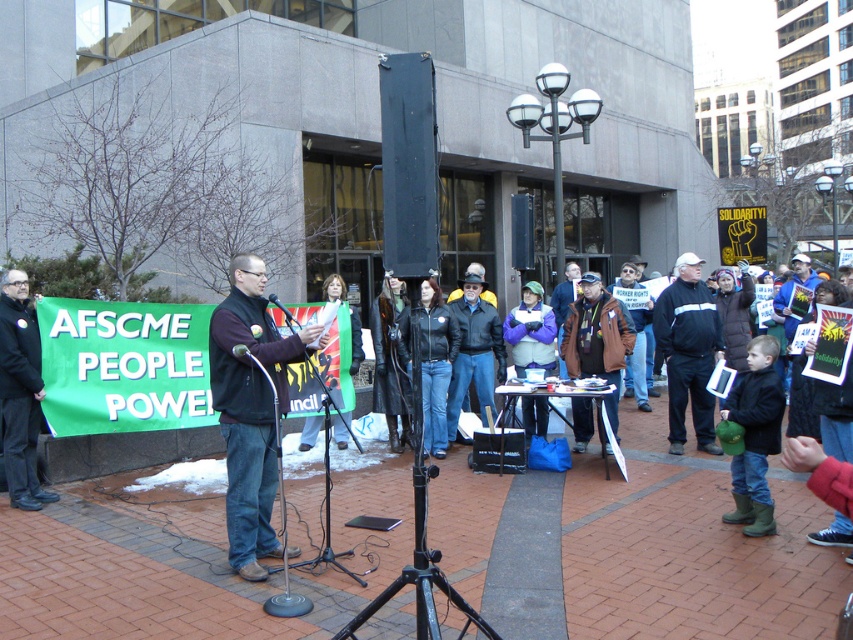
Does dark blue jeans at center come in front of matte black jacket at center?

That is True.

Between point (282, 339) and point (303, 440), which one is positioned in front?

Positioned in front is point (282, 339).

The image size is (853, 640). I want to click on dark blue jeans at center, so click(248, 410).

Who is taller, black fabric jacket at left or black leather jacket at center?

black fabric jacket at left

Is point (22, 408) farther from viewer compared to point (427, 300)?

No, (22, 408) is closer to viewer.

Find the location of a particular element. This screenshot has width=853, height=640. black fabric jacket at left is located at coordinates (20, 392).

Does black fabric jacket at left have a greater width compared to purple fleece jacket at center?

Incorrect, black fabric jacket at left's width does not surpass purple fleece jacket at center's.

Is black fabric jacket at left below purple fleece jacket at center?

Indeed, black fabric jacket at left is positioned under purple fleece jacket at center.

Identify the location of black fabric jacket at left. (20, 392).